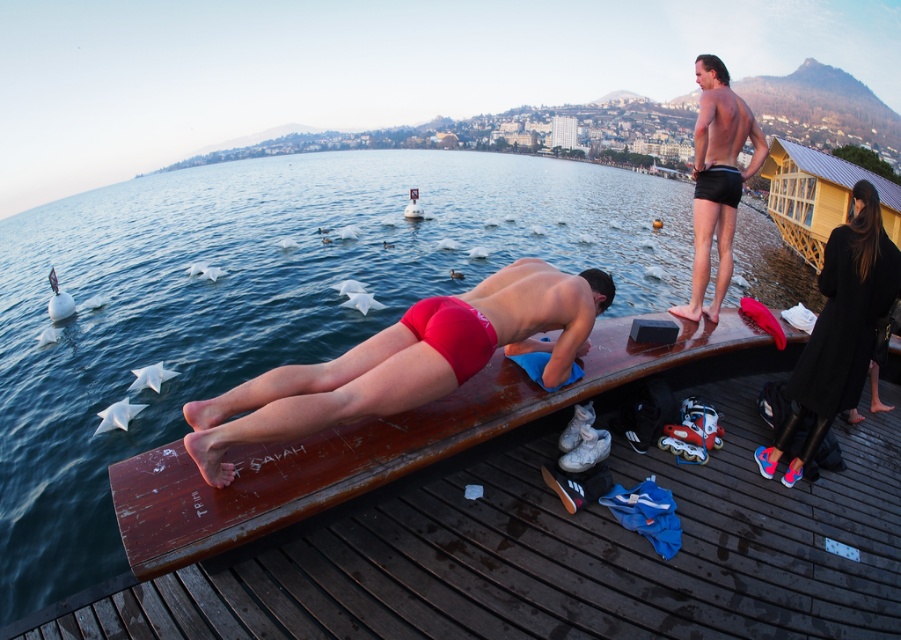
You are a photographer standing at the end of the pier and want to take a photo that includes both the black leather pants at right and the shiny black shorts at upper right. The camera you have can only capture objects within a 4.5 meter range. Will both subjects be in frame?

The black leather pants at right and shiny black shorts at upper right are 3.08 meters apart from each other. Since the camera can capture up to 4.5 meters, both subjects will be within the frame as their distance is less than the maximum range.

You are a photographer trying to capture the details of the smooth black dress at upper right and the shiny black shorts at upper right in the same frame. Since both items are at the same location, which one would require you to zoom in more to see clearly?

The smooth black dress at upper right is thinner than the shiny black shorts at upper right, so you would need to zoom in more to see the details of the smooth black dress at upper right because it is smaller in size.

You are standing at the point marked as point (867, 337) on the pier. You want to jump into the lake. The safety rule states that you must be at least 4 meters away from any other person before jumping. Are you compliant with this rule?

The distance between you and the viewer is 3.59 meters, which is less than the required 4 meters. Therefore, you are not compliant with the safety rule and should move further away before jumping.